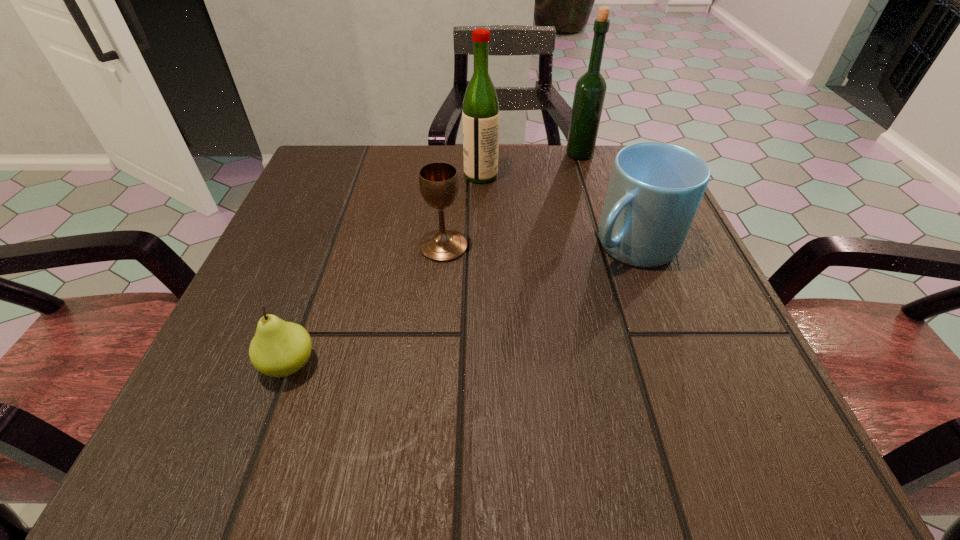
Where is `the right liquor`? The image size is (960, 540). the right liquor is located at coordinates (590, 89).

Locate an element on the screen. The height and width of the screenshot is (540, 960). the farthest object is located at coordinates (590, 89).

The image size is (960, 540). In order to click on the left liquor in this screenshot , I will do `click(480, 116)`.

Identify the location of the nearer liquor. This screenshot has width=960, height=540. (480, 116).

I want to click on mug, so click(655, 188).

Where is `chalice`? This screenshot has height=540, width=960. chalice is located at coordinates (438, 181).

Where is `the leftmost object`? The width and height of the screenshot is (960, 540). the leftmost object is located at coordinates (279, 348).

Find the location of a particular element. the nearest object is located at coordinates (279, 348).

Find the location of `free region located on the front of the farthest object`. free region located on the front of the farthest object is located at coordinates (588, 179).

Find the location of `free spot located on the label of the nearer liquor`. free spot located on the label of the nearer liquor is located at coordinates (348, 176).